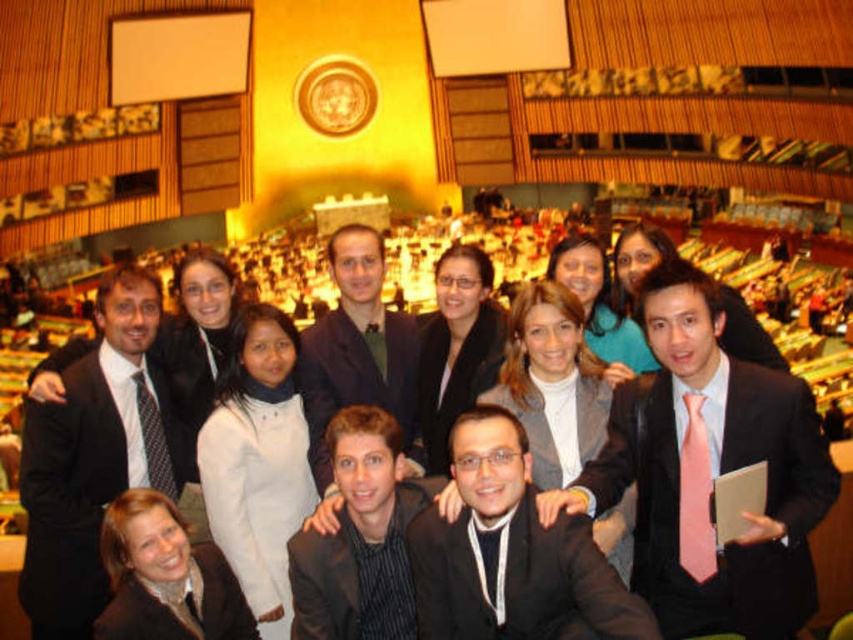
You are a photographer adjusting your camera settings to focus on the black suit at center and the matte black jacket at center. Which one should you focus on first to ensure both are in sharp focus?

The black suit at center is closer to the viewer than the matte black jacket at center, so you should focus on the black suit at center first to ensure both are in sharp focus.

You are a photographer at the event and want to ensure the black suit at center and dark blue suit at center are positioned correctly. Which one is on the right side of the other?

The black suit at center is to the right of the dark blue suit at center.